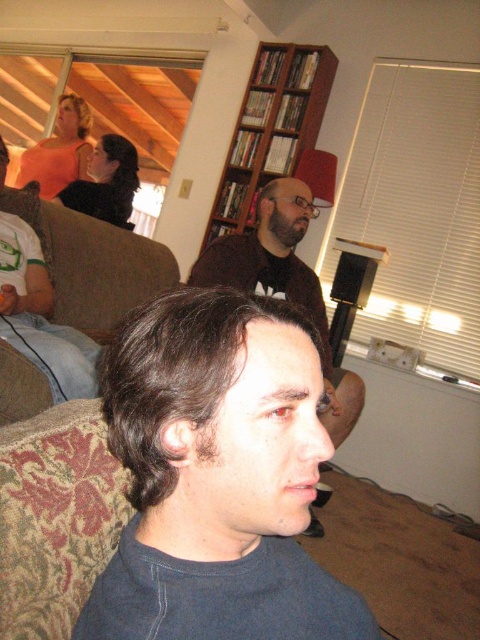
Question: Based on their relative distances, which object is farther from the brown wooden bookshelf at upper center?

Choices:
 (A) dark brown hair at center
 (B) dark blue cotton shirt at center

Answer: (B)

Question: Can you confirm if dark blue cotton shirt at center is wider than dark brown hair at center?

Choices:
 (A) yes
 (B) no

Answer: (B)

Question: Which point is closer to the camera?

Choices:
 (A) dark blue cotton shirt at center
 (B) dark brown hair at center

Answer: (A)

Question: Which object is closer to the camera taking this photo?

Choices:
 (A) brown wooden bookshelf at upper center
 (B) dark brown hair at center

Answer: (B)

Question: Can you confirm if dark blue cotton shirt at center is smaller than dark brown hair at center?

Choices:
 (A) yes
 (B) no

Answer: (A)

Question: Does dark blue cotton shirt at center have a greater width compared to dark brown hair at center?

Choices:
 (A) no
 (B) yes

Answer: (A)